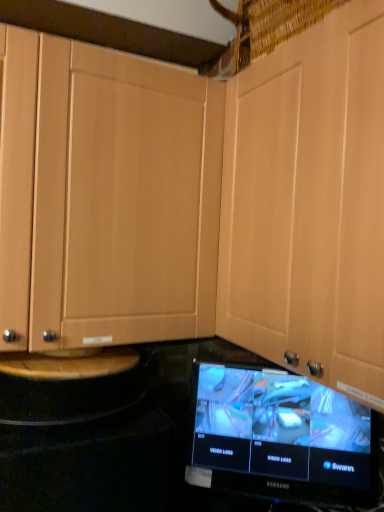
Question: Is the depth of matte wood cabinet at center greater than that of black glossy monitor at lower center?

Choices:
 (A) yes
 (B) no

Answer: (B)

Question: Is matte wood cabinet at center to the right of black glossy monitor at lower center from the viewer's perspective?

Choices:
 (A) no
 (B) yes

Answer: (B)

Question: From the image's perspective, does matte wood cabinet at center appear higher than black glossy monitor at lower center?

Choices:
 (A) no
 (B) yes

Answer: (B)

Question: Does matte wood cabinet at center have a larger size compared to black glossy monitor at lower center?

Choices:
 (A) no
 (B) yes

Answer: (B)

Question: Considering the relative sizes of matte wood cabinet at center and black glossy monitor at lower center in the image provided, is matte wood cabinet at center taller than black glossy monitor at lower center?

Choices:
 (A) yes
 (B) no

Answer: (A)

Question: Can you confirm if matte wood cabinet at center is wider than black glossy monitor at lower center?

Choices:
 (A) yes
 (B) no

Answer: (A)

Question: From the image's perspective, is black glossy monitor at lower center located above matte wood cabinet at center?

Choices:
 (A) no
 (B) yes

Answer: (A)

Question: From a real-world perspective, is black glossy monitor at lower center over matte wood cabinet at center?

Choices:
 (A) yes
 (B) no

Answer: (B)

Question: Is black glossy monitor at lower center facing towards matte wood cabinet at center?

Choices:
 (A) no
 (B) yes

Answer: (A)

Question: Is black glossy monitor at lower center outside of matte wood cabinet at center?

Choices:
 (A) yes
 (B) no

Answer: (A)

Question: Considering the relative sizes of black glossy monitor at lower center and matte wood cabinet at center in the image provided, is black glossy monitor at lower center wider than matte wood cabinet at center?

Choices:
 (A) no
 (B) yes

Answer: (A)

Question: Is black glossy monitor at lower center oriented away from matte wood cabinet at center?

Choices:
 (A) no
 (B) yes

Answer: (A)

Question: From the image's perspective, is black glossy monitor at lower center above or below matte wood cabinet at center?

Choices:
 (A) below
 (B) above

Answer: (A)